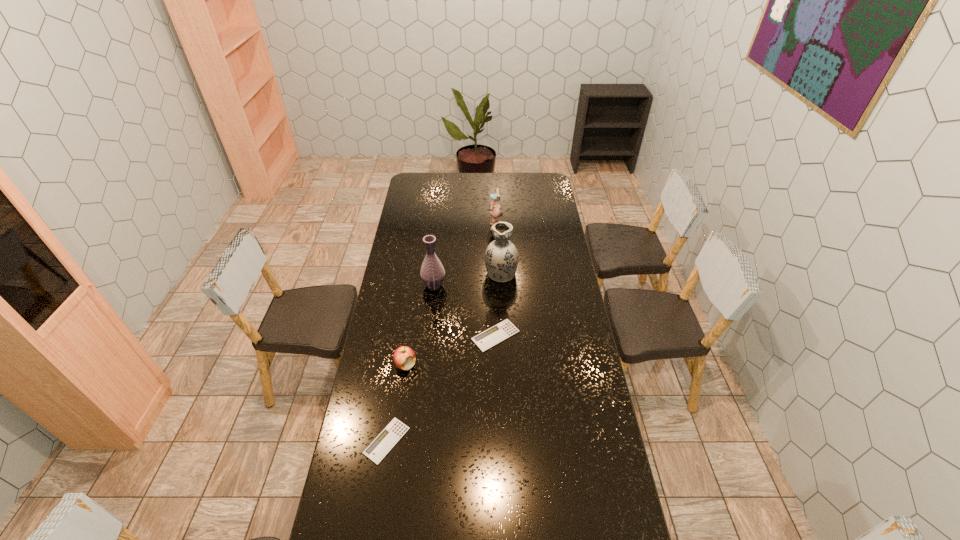
Identify the location of calculator that is at the left edge. (376, 451).

The image size is (960, 540). Find the location of `apple at the left edge`. apple at the left edge is located at coordinates [x=404, y=357].

This screenshot has width=960, height=540. Find the location of `free space at the far edge`. free space at the far edge is located at coordinates (468, 193).

Locate an element on the screen. The image size is (960, 540). free region at the near edge is located at coordinates (518, 509).

You are a GUI agent. You are given a task and a screenshot of the screen. Output one action in this format:
    pyautogui.click(x=<x>, y=<y>)
    Task: Click on the free space at the left edge of the desktop
    The width and height of the screenshot is (960, 540).
    Given the screenshot: What is the action you would take?
    pyautogui.click(x=374, y=355)

In the image, there is a desktop. What are the coordinates of `vacant area at the right edge` in the screenshot? It's located at (536, 221).

Locate an element on the screen. This screenshot has height=540, width=960. free space at the far left corner is located at coordinates (420, 182).

I want to click on vacant space at the far right corner of the desktop, so click(x=542, y=190).

Image resolution: width=960 pixels, height=540 pixels. I want to click on free space between the apple and the figurine, so click(x=450, y=296).

The height and width of the screenshot is (540, 960). What are the coordinates of `free space between the third tallest object and the left vase` in the screenshot? It's located at (465, 256).